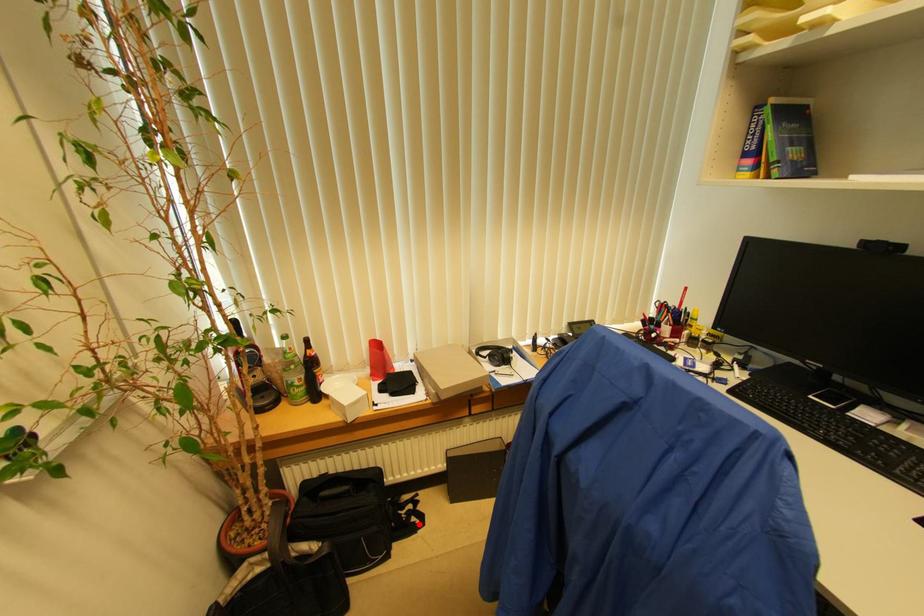
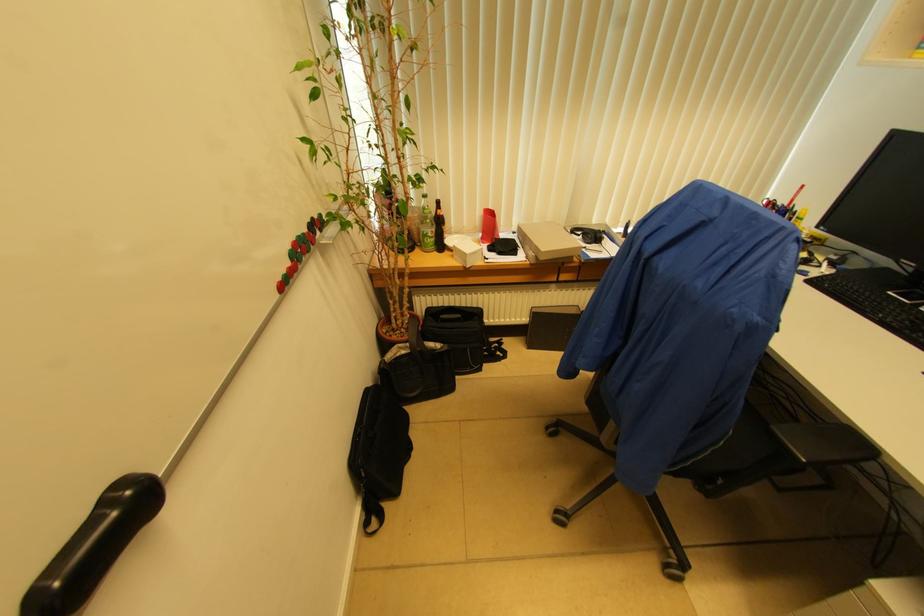
Question: I am providing you with two images of the same scene from different viewpoints. A red point is shown in image1. For the corresponding object point in image2, is it positioned nearer or farther from the camera?

Choices:
 (A) Nearer
 (B) Farther

Answer: (B)